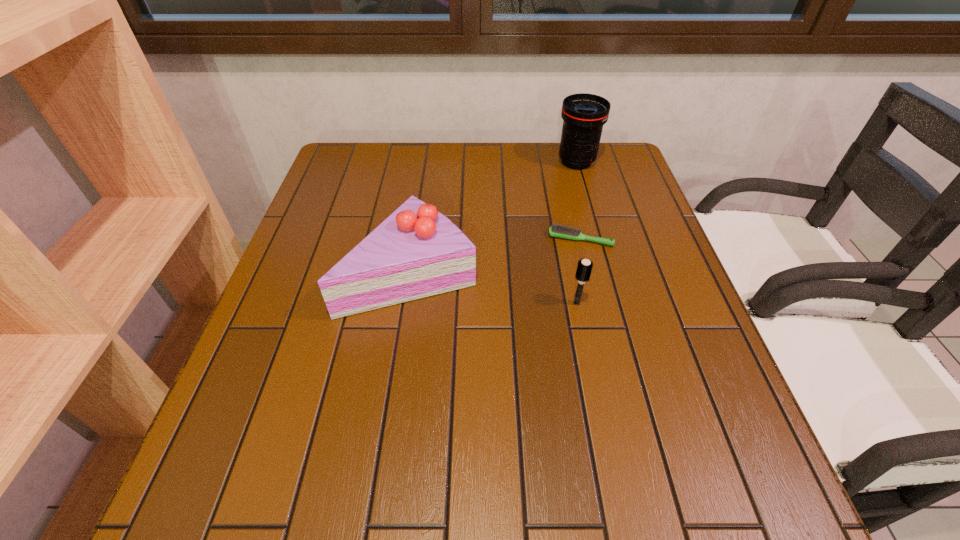
The height and width of the screenshot is (540, 960). Find the location of `the farthest object`. the farthest object is located at coordinates (583, 114).

Image resolution: width=960 pixels, height=540 pixels. What are the coordinates of `cake` in the screenshot? It's located at (416, 252).

This screenshot has width=960, height=540. What are the coordinates of `the third tallest object` in the screenshot? It's located at (584, 268).

At what (x,y) coordinates should I click in order to perform the action: click on the taller hairbrush. Please return your answer as a coordinate pair (x, y). Looking at the image, I should click on (584, 268).

Locate an element on the screen. This screenshot has height=540, width=960. the shortest object is located at coordinates (560, 231).

Locate an element on the screen. The width and height of the screenshot is (960, 540). the farther hairbrush is located at coordinates (560, 231).

I want to click on vacant area situated on the left of the farthest object, so click(x=483, y=162).

This screenshot has width=960, height=540. Identify the location of free space located on the back of the cake. (426, 170).

Where is `vacant area situated 0.230m on the right of the third tallest object`? This screenshot has height=540, width=960. vacant area situated 0.230m on the right of the third tallest object is located at coordinates (690, 303).

Where is `vacant space positioned 0.220m on the left of the shortest object`? This screenshot has width=960, height=540. vacant space positioned 0.220m on the left of the shortest object is located at coordinates (461, 239).